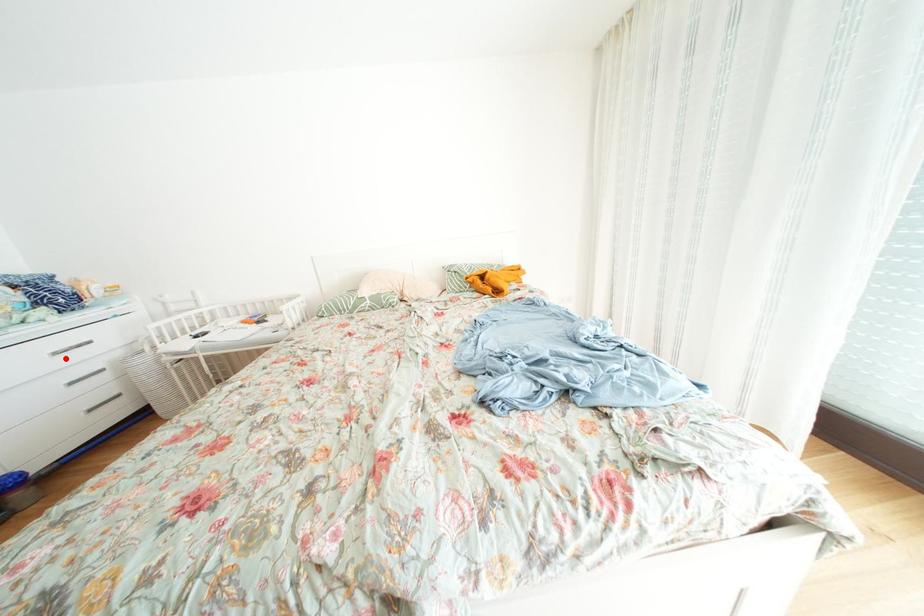
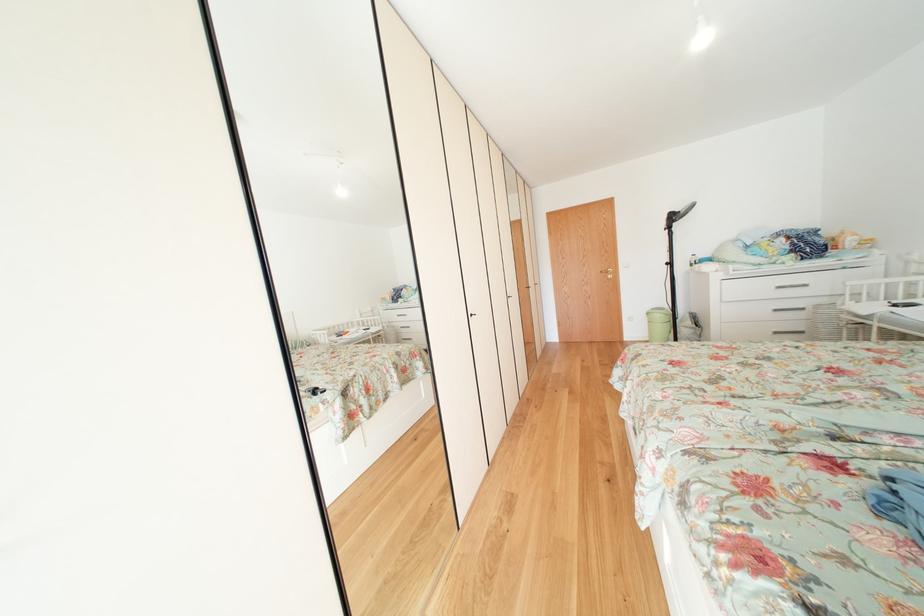
Question: A red point is marked in image1. In image2, is the corresponding 3D point closer to the camera or farther? Reply with the corresponding letter.

Choices:
 (A) The corresponding 3D point is closer.
 (B) The corresponding 3D point is farther.

Answer: (A)